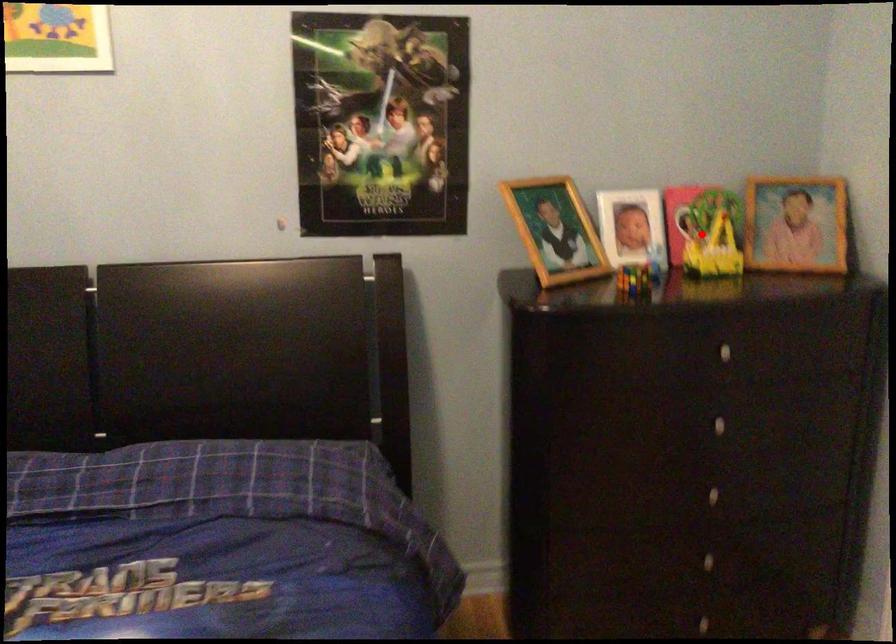
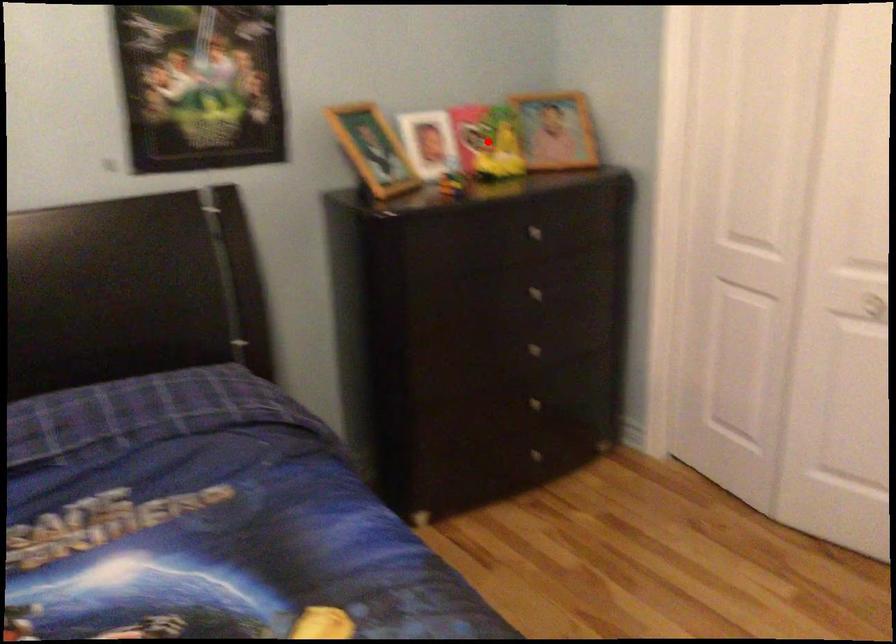
I am providing you with two images of the same scene from different viewpoints. A red point is marked on the first image and another point is marked on the second image. Are the points marked in image1 and image2 representing the same 3D position?

Yes